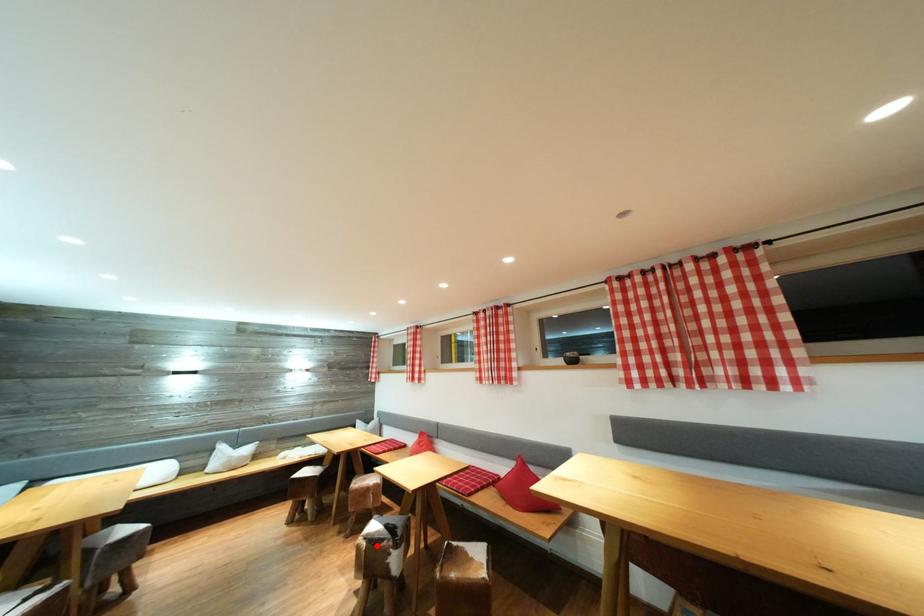
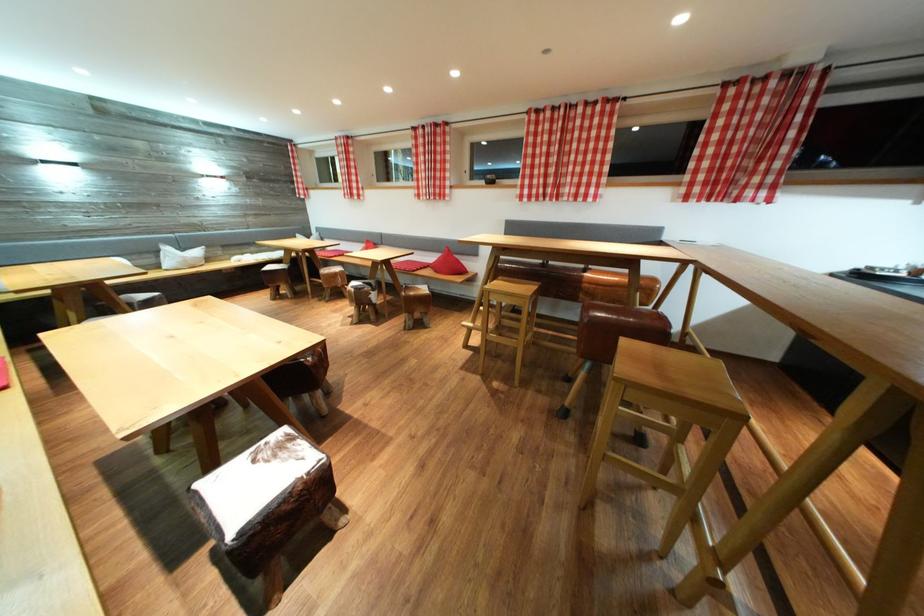
Find the pixel in the second image that matches the highlighted location in the first image.

(362, 294)